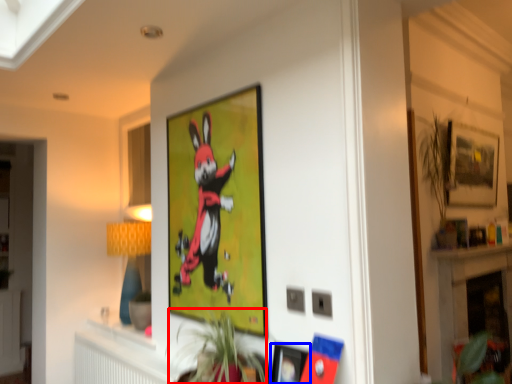
Question: Which object is further to the camera taking this photo, plant (highlighted by a red box) or picture frame (highlighted by a blue box)?

Choices:
 (A) plant
 (B) picture frame

Answer: (B)